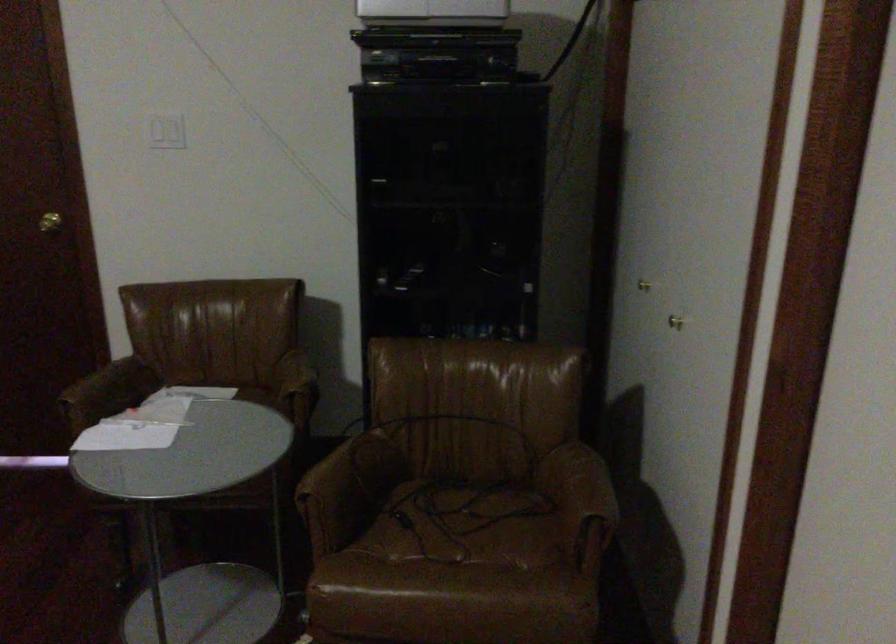
What do you see at coordinates (49, 222) in the screenshot? This screenshot has height=644, width=896. I see `the gold door knob` at bounding box center [49, 222].